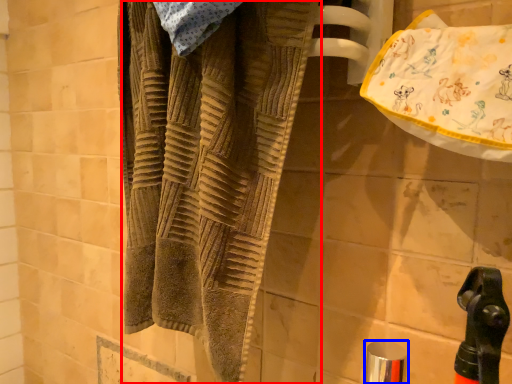
Question: Which point is closer to the camera, towel (highlighted by a red box) or faucet (highlighted by a blue box)?

Choices:
 (A) towel
 (B) faucet

Answer: (A)